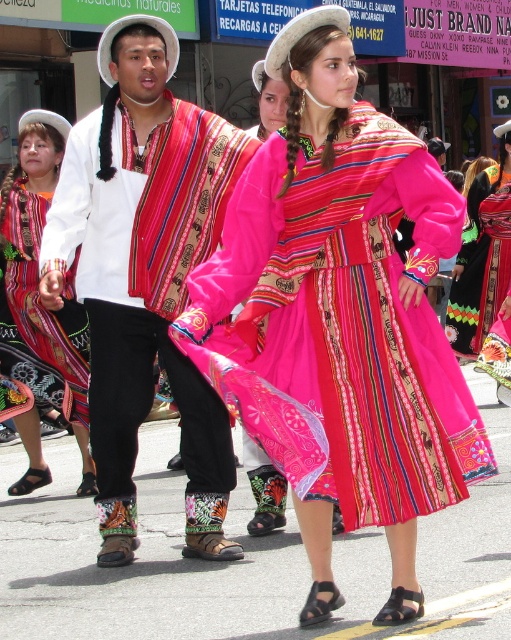
You are a photographer at the event and want to take a photo of both the velvet pink dress at center and the matte white shirt at center. The camera can only focus on objects within a 1.5 meter range. Will both objects be in focus?

The velvet pink dress at center and the matte white shirt at center are 1.29 meters apart from each other, which is within the camera focus range of 1.5 meters. Therefore, both objects will be in focus.

You are a photographer standing 10 feet away from the velvet pink dress at center and the matte black dress at center. You want to capture both dresses in a single photo without moving your position. Can you fit both dresses into your camera frame if your camera has a 5 feet wide field of view?

The velvet pink dress at center and matte black dress at center are 8.69 feet apart from each other. Since your camera has a 5 feet wide field of view and the distance between the dresses is greater than that, you cannot fit both dresses into the frame without moving your position.

You are a photographer trying to capture both the matte white shirt at center and the matte black dress at center in a single frame. Based on their widths, which one should you adjust your camera angle to prioritize to ensure both fit in the shot?

The matte white shirt at center might be wider than the matte black dress at center, so you should prioritize adjusting your camera angle to accommodate the wider matte white shirt at center to ensure both fit in the shot.